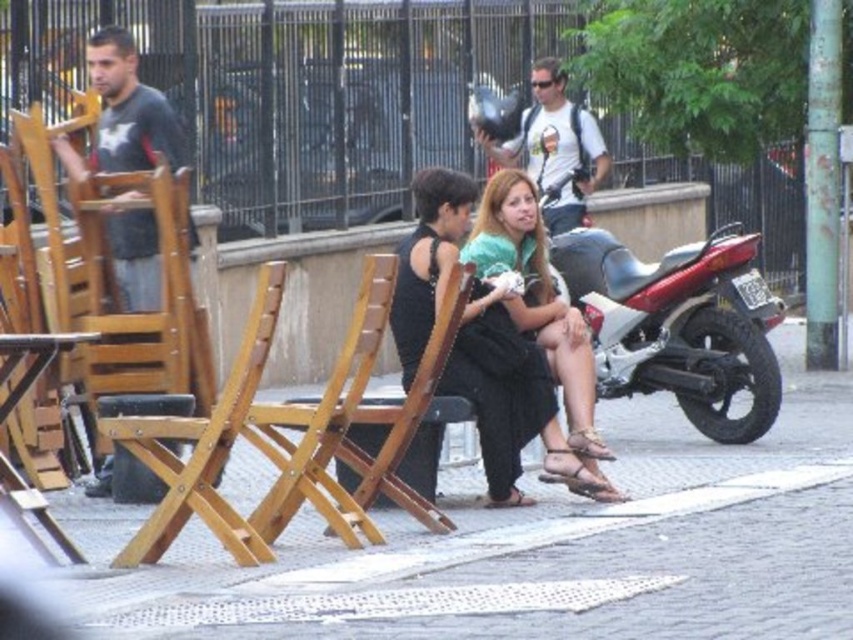
Question: Can you confirm if matte green dress at center is smaller than matte black camera at upper center?

Choices:
 (A) no
 (B) yes

Answer: (B)

Question: Based on their relative distances, which object is nearer to the matte green dress at center?

Choices:
 (A) smooth concrete pavement at center
 (B) wooden chair at left
 (C) matte black camera at upper center

Answer: (B)

Question: Which point is closer to the camera taking this photo?

Choices:
 (A) (560, 230)
 (B) (521, 212)

Answer: (B)

Question: Which object is the farthest from the matte green dress at center?

Choices:
 (A) matte black camera at upper center
 (B) smooth concrete pavement at center
 (C) dark gray fabric shirt at left
 (D) wooden chair at left

Answer: (A)

Question: Is dark gray fabric shirt at left positioned behind matte black camera at upper center?

Choices:
 (A) yes
 (B) no

Answer: (B)

Question: Can you confirm if wooden chair at left is positioned to the left of matte green dress at center?

Choices:
 (A) yes
 (B) no

Answer: (A)